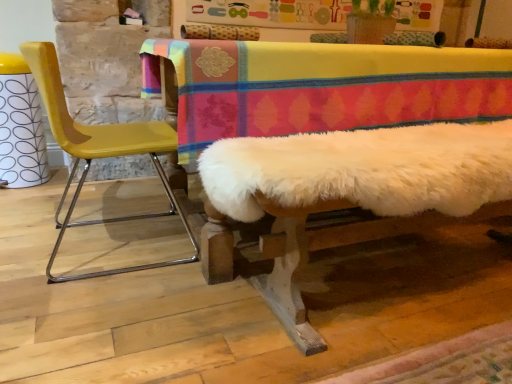
Find the location of a particular element. Image resolution: width=512 pixels, height=384 pixels. vacant point to the left of yellow fabric chair at left is located at coordinates (31, 238).